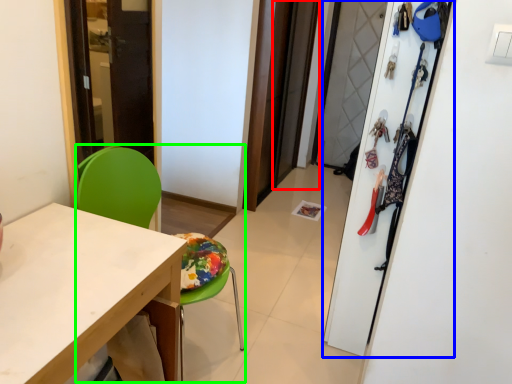
Question: Estimate the real-world distances between objects in this image. Which object is closer to screen door (highlighted by a red box), closet (highlighted by a blue box) or armchair (highlighted by a green box)?

Choices:
 (A) closet
 (B) armchair

Answer: (A)